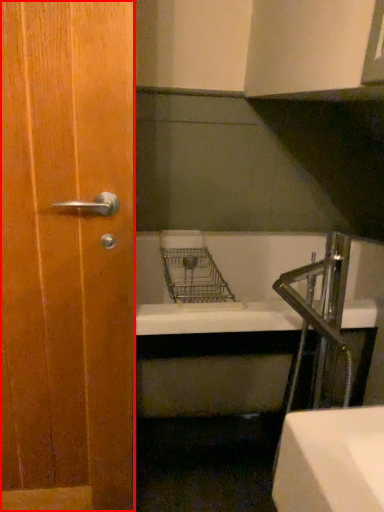
Question: From the image, what is the correct spatial relationship of door (annotated by the red box) in relation to faucet?

Choices:
 (A) left
 (B) right

Answer: (A)